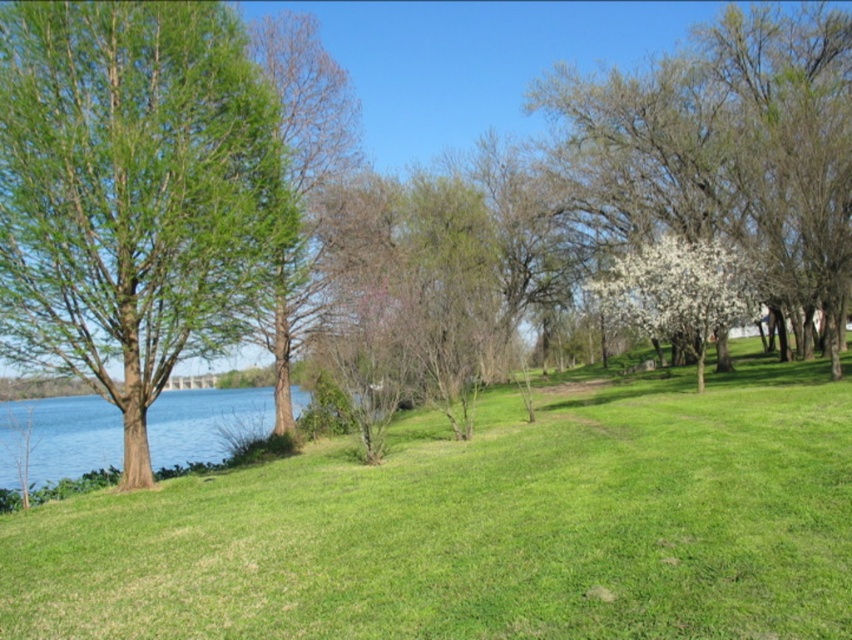
You are standing at the center of the lawn and want to walk towards the white blossoming tree at center. Which direction should you head?

The white blossoming tree at center is located at point (734,144), so you should head towards the lower left direction to reach it.

You are standing at the center of the image, and you want to walk towards the green leafy tree at left. Which direction should you face to head directly towards it?

You should face towards the left direction to head directly towards the green leafy tree at left since it is positioned at point (130, 192), which is to the left of the center.